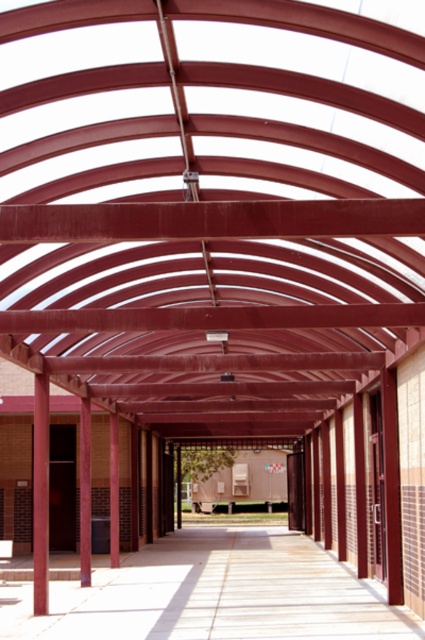
Locate an element on the screen. metallic red roof at center is located at coordinates (207, 204).

Is point (181, 241) in front of point (365, 620)?

Yes, it is in front of point (365, 620).

The height and width of the screenshot is (640, 425). In order to click on metallic red roof at center in this screenshot , I will do `click(207, 204)`.